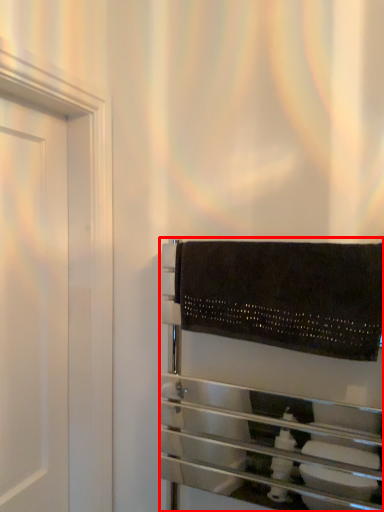
Question: From the image's perspective, what is the correct spatial positioning of towel rack (annotated by the red box) in reference to bath towel?

Choices:
 (A) below
 (B) above

Answer: (A)